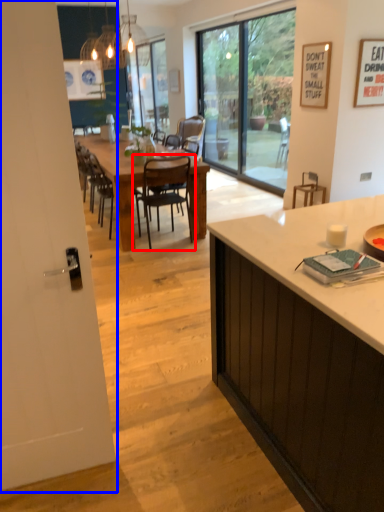
Question: Which point is closer to the camera, chair (highlighted by a red box) or screen door (highlighted by a blue box)?

Choices:
 (A) chair
 (B) screen door

Answer: (B)